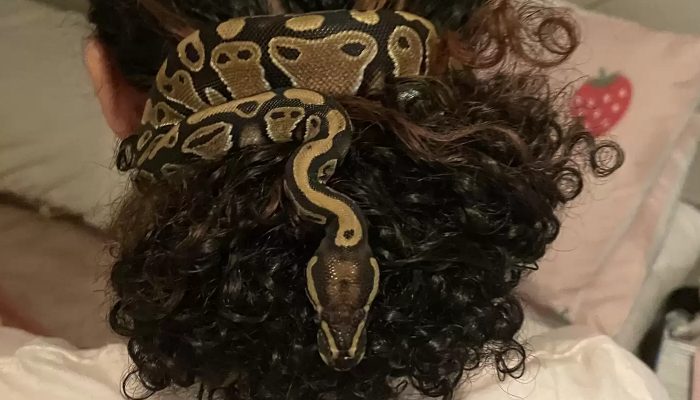
In order to click on white pillow in this screenshot , I will do `click(55, 101)`.